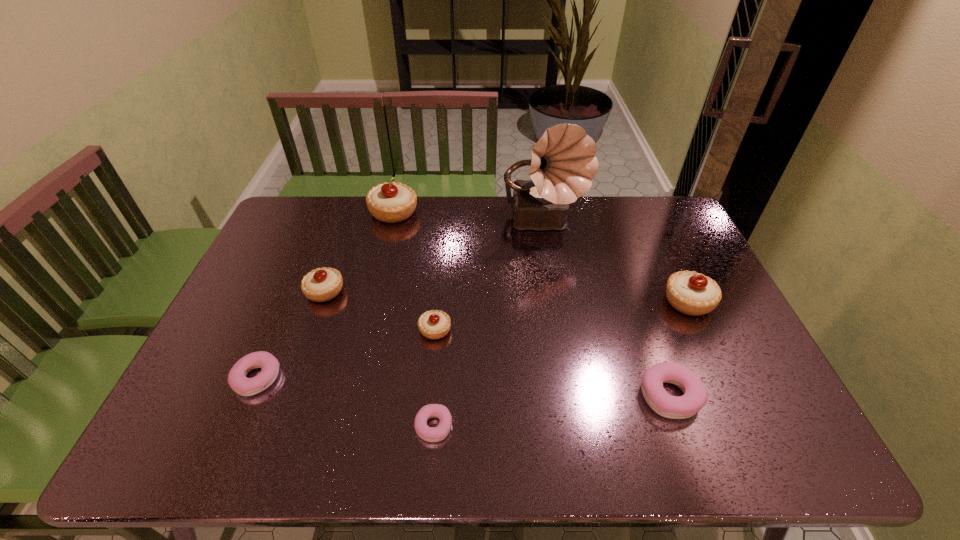
At what (x,y) coordinates should I click in order to perform the action: click on free space between the brown record player and the second shortest pastry. Please return your answer as a coordinate pair (x, y). Looking at the image, I should click on (400, 301).

The height and width of the screenshot is (540, 960). I want to click on vacant space in between the third biggest beige pastry and the seventh object from left to right, so click(497, 343).

Image resolution: width=960 pixels, height=540 pixels. What are the coordinates of `vacant area that lies between the shortest object and the fourth shortest pastry` in the screenshot? It's located at (434, 378).

You are a GUI agent. You are given a task and a screenshot of the screen. Output one action in this format:
    pyautogui.click(x=<x>, y=<y>)
    Task: Click on the vacant space in between the second beige pastry from right to left and the third object from right to left
    This screenshot has width=960, height=540.
    Given the screenshot: What is the action you would take?
    pyautogui.click(x=490, y=276)

Where is `vacant area that lies between the leftmost beige pastry and the fifth tallest object`? This screenshot has height=540, width=960. vacant area that lies between the leftmost beige pastry and the fifth tallest object is located at coordinates (380, 310).

Locate which object is the closest to the sixth shortest object. Please provide its 2D coordinates. Your answer should be formatted as a tuple, i.e. [(x, y)], where the tuple contains the x and y coordinates of a point satisfying the conditions above.

[(695, 396)]

Identify the location of object that is the closest to the rightmost pastry. The height and width of the screenshot is (540, 960). (695, 396).

Locate which pastry is the fourth closest to the smallest pink pastry. Please provide its 2D coordinates. Your answer should be formatted as a tuple, i.e. [(x, y)], where the tuple contains the x and y coordinates of a point satisfying the conditions above.

[(695, 396)]

Find the location of `pastry that is the second closest one to the rightmost beige pastry`. pastry that is the second closest one to the rightmost beige pastry is located at coordinates (433, 324).

Select which beige pastry appears as the third closest to the second smallest pink pastry. Please provide its 2D coordinates. Your answer should be formatted as a tuple, i.e. [(x, y)], where the tuple contains the x and y coordinates of a point satisfying the conditions above.

[(391, 202)]